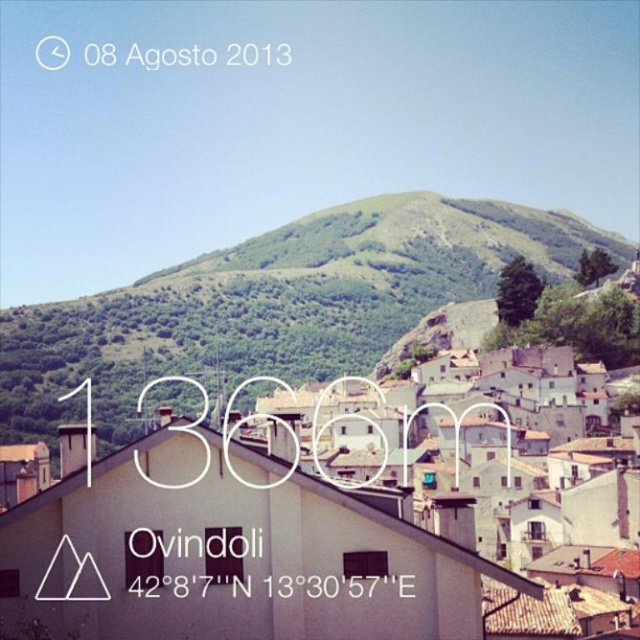
Question: Which object is closer to the camera taking this photo?

Choices:
 (A) green grassy hill at upper center
 (B) white matte building at center

Answer: (B)

Question: Can you confirm if white matte building at center is positioned to the right of green grassy hill at upper center?

Choices:
 (A) yes
 (B) no

Answer: (B)

Question: Which of the following is the farthest from the observer?

Choices:
 (A) green grassy hill at upper center
 (B) white matte building at center

Answer: (A)

Question: Does white matte building at center have a greater width compared to green grassy hill at upper center?

Choices:
 (A) yes
 (B) no

Answer: (B)

Question: Considering the relative positions of white matte building at center and green grassy hill at upper center in the image provided, where is white matte building at center located with respect to green grassy hill at upper center?

Choices:
 (A) below
 (B) above

Answer: (A)